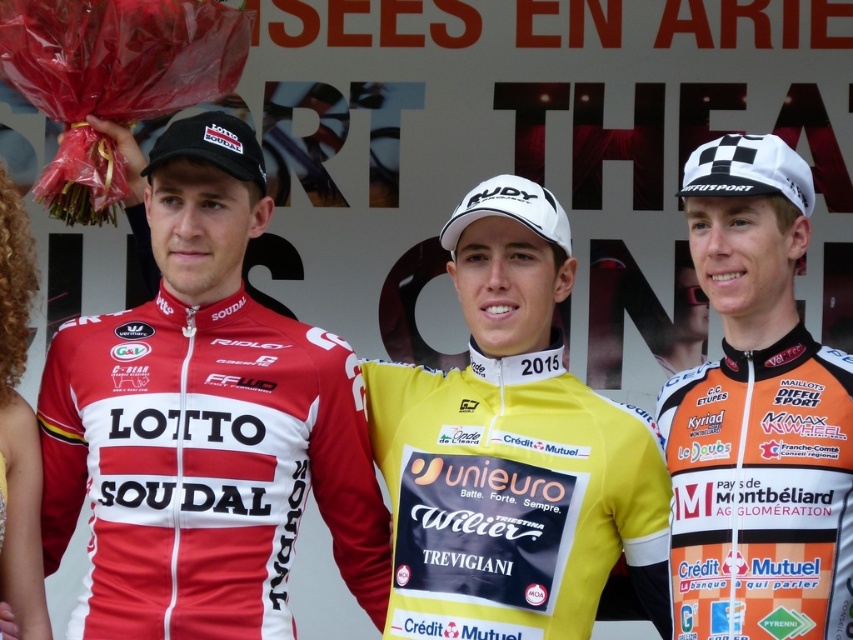
You are a photographer positioned in front of the podium. You need to take a photo of the matte red jersey at center and the orange jersey at right. According to the scene description, which jersey is lower in the frame?

The matte red jersey at center is located below the orange jersey at right, so it is lower in the frame.